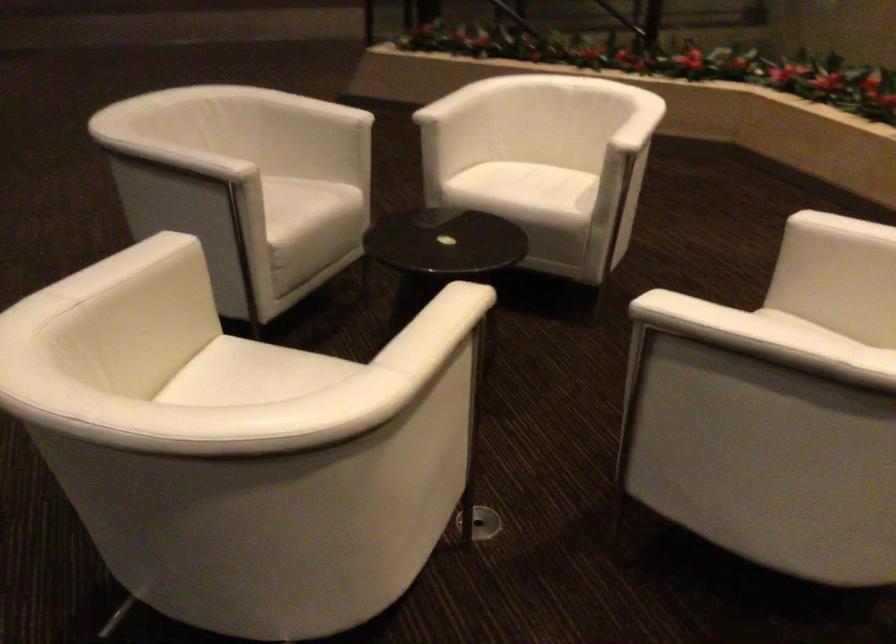
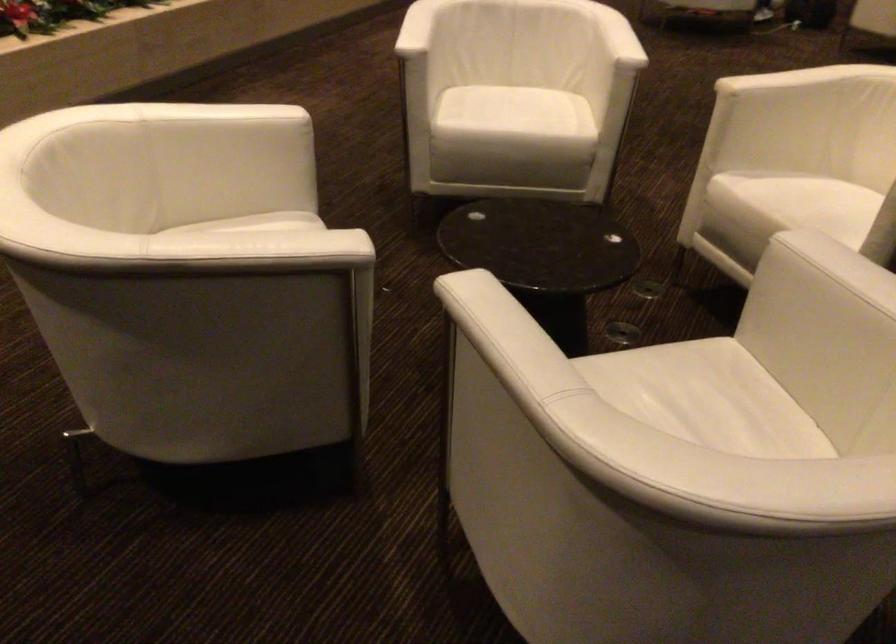
The point at (305,105) is marked in the first image. Where is the corresponding point in the second image?

(494, 322)